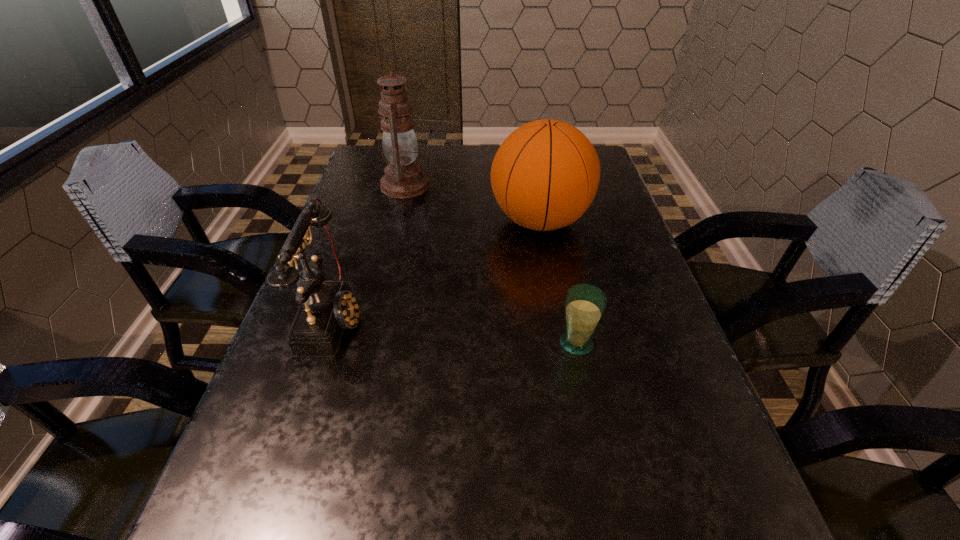
Where is `vacant area that lies between the shortest object and the basketball`? The height and width of the screenshot is (540, 960). vacant area that lies between the shortest object and the basketball is located at coordinates (559, 282).

At what (x,y) coordinates should I click in order to perform the action: click on free area in between the shortest object and the basketball. Please return your answer as a coordinate pair (x, y). The height and width of the screenshot is (540, 960). Looking at the image, I should click on [x=559, y=282].

Find the location of `free space between the basketball and the tallest object`. free space between the basketball and the tallest object is located at coordinates (472, 203).

Identify the location of unoccupied area between the glass and the basketball. The width and height of the screenshot is (960, 540). (559, 282).

This screenshot has width=960, height=540. Find the location of `vacant area that lies between the telephone and the glass`. vacant area that lies between the telephone and the glass is located at coordinates (455, 330).

The image size is (960, 540). Find the location of `empty space that is in between the basketball and the telephone`. empty space that is in between the basketball and the telephone is located at coordinates (437, 269).

The width and height of the screenshot is (960, 540). In order to click on free space between the basketball and the glass in this screenshot , I will do `click(559, 282)`.

What are the coordinates of `free space between the basketball and the oil lamp` in the screenshot? It's located at (472, 203).

The image size is (960, 540). Identify the location of the closest object relative to the basketball. tap(404, 178).

You are a GUI agent. You are given a task and a screenshot of the screen. Output one action in this format:
    pyautogui.click(x=<x>, y=<y>)
    Task: Click on the third closest object to the telephone
    
    Given the screenshot: What is the action you would take?
    pyautogui.click(x=584, y=305)